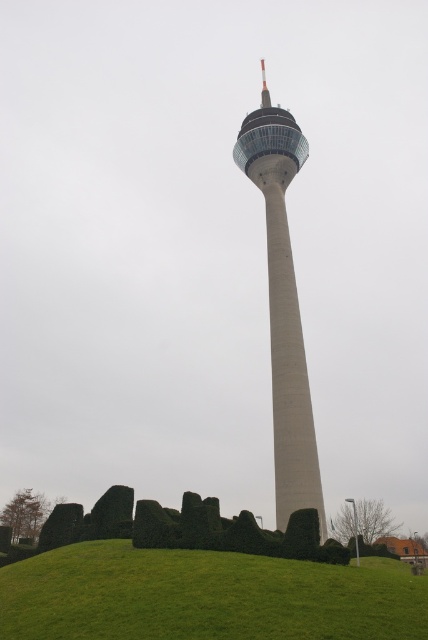
Question: Which object appears closest to the camera in this image?

Choices:
 (A) green grassy hill at lower center
 (B) green bushy hedge at lower center
 (C) smooth concrete tower at center

Answer: (A)

Question: Which point is farther from the camera taking this photo?

Choices:
 (A) (291, 308)
 (B) (109, 637)
 (C) (222, 536)

Answer: (A)

Question: Considering the relative positions of green grassy hill at lower center and green bushy hedge at lower center in the image provided, where is green grassy hill at lower center located with respect to green bushy hedge at lower center?

Choices:
 (A) above
 (B) below

Answer: (B)

Question: Does green grassy hill at lower center appear over smooth concrete tower at center?

Choices:
 (A) no
 (B) yes

Answer: (A)

Question: Is green grassy hill at lower center positioned behind green bushy hedge at lower center?

Choices:
 (A) no
 (B) yes

Answer: (A)

Question: Which is farther from the green bushy hedge at lower center?

Choices:
 (A) smooth concrete tower at center
 (B) green grassy hill at lower center

Answer: (A)